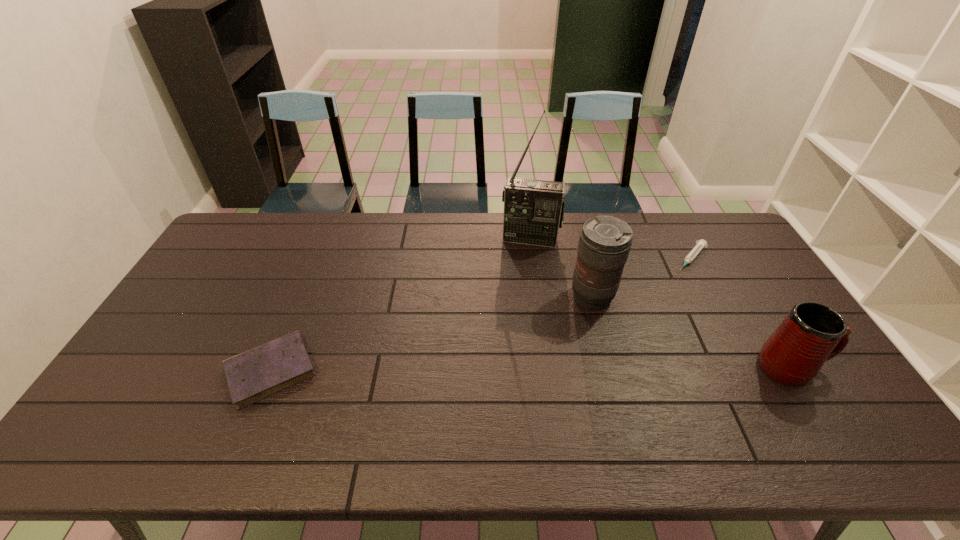
Locate an element on the screen. Image resolution: width=960 pixels, height=540 pixels. object that ranks as the closest to the third farthest object is located at coordinates (533, 209).

This screenshot has width=960, height=540. I want to click on free space that satisfies the following two spatial constraints: 1. on the front side of the third shortest object; 2. on the side of the telephoto lens with the handle, so click(611, 367).